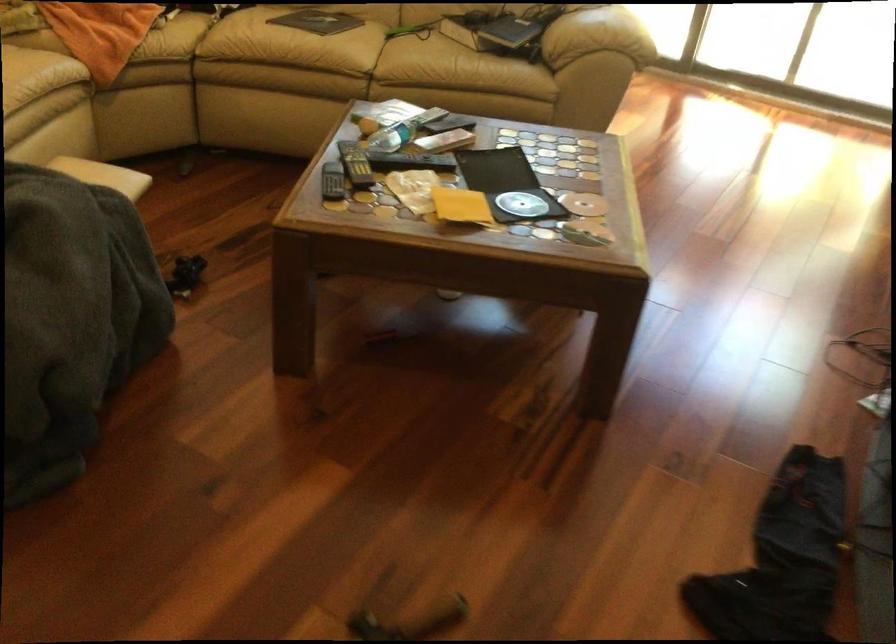
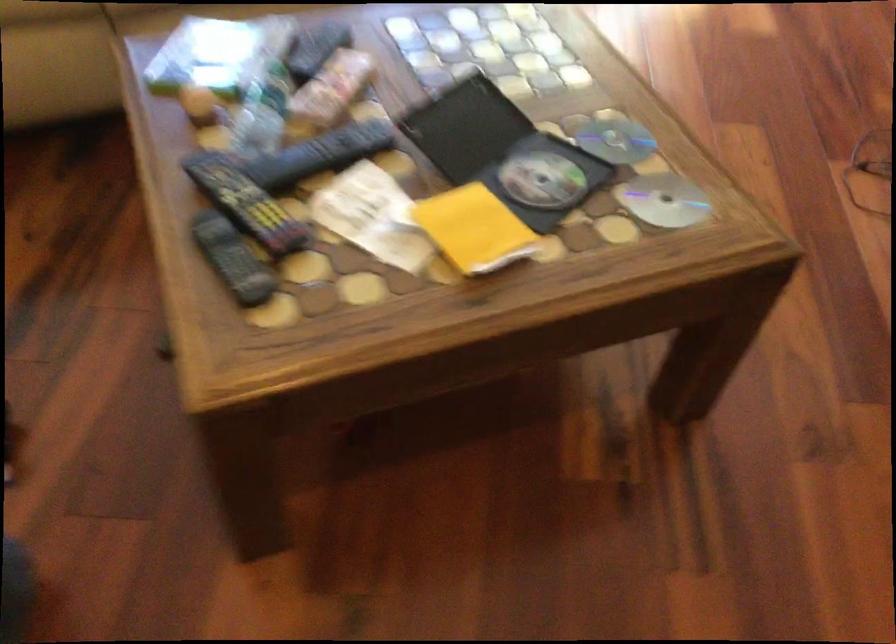
Find the pixel in the second image that matches point (520, 202) in the first image.

(541, 180)